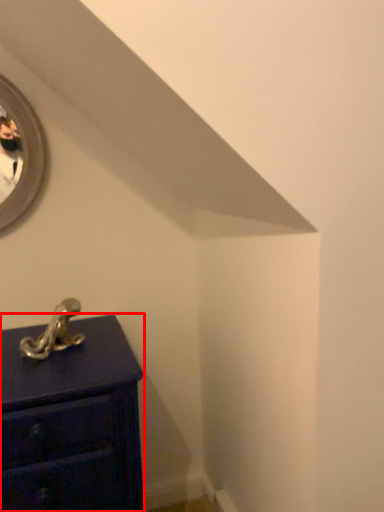
Question: From the image's perspective, considering the relative positions of chest of drawers (annotated by the red box) and antique in the image provided, where is chest of drawers (annotated by the red box) located with respect to the staircase?

Choices:
 (A) below
 (B) above

Answer: (A)